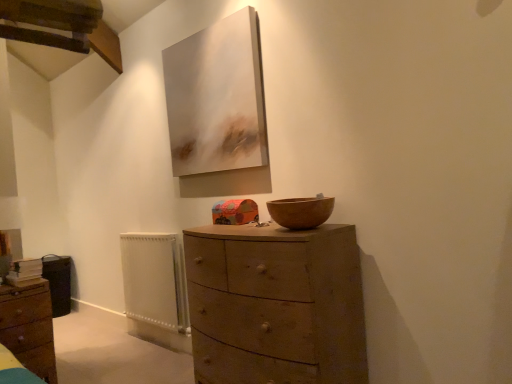
Question: Are wooden bowl at center and white painted metal radiator at lower left making contact?

Choices:
 (A) yes
 (B) no

Answer: (B)

Question: Considering the relative sizes of wooden bowl at center and white painted metal radiator at lower left in the image provided, is wooden bowl at center bigger than white painted metal radiator at lower left?

Choices:
 (A) yes
 (B) no

Answer: (B)

Question: From the image's perspective, is wooden bowl at center located beneath white painted metal radiator at lower left?

Choices:
 (A) yes
 (B) no

Answer: (B)

Question: Is wooden bowl at center outside white painted metal radiator at lower left?

Choices:
 (A) yes
 (B) no

Answer: (A)

Question: Is wooden bowl at center aimed at white painted metal radiator at lower left?

Choices:
 (A) no
 (B) yes

Answer: (A)

Question: Considering the positions of point (41, 377) and point (295, 208), is point (41, 377) closer or farther from the camera than point (295, 208)?

Choices:
 (A) farther
 (B) closer

Answer: (A)

Question: In terms of width, does matte brown chest of drawers at lower left, which ranks as the 2th chest of drawers in right-to-left order, look wider or thinner when compared to wooden bowl at center?

Choices:
 (A) wide
 (B) thin

Answer: (A)

Question: From a real-world perspective, relative to wooden bowl at center, is matte brown chest of drawers at lower left, arranged as the first chest of drawers when viewed from the left, vertically above or below?

Choices:
 (A) below
 (B) above

Answer: (A)

Question: Is matte brown chest of drawers at lower left, which ranks as the 2th chest of drawers in right-to-left order, in front of or behind wooden bowl at center in the image?

Choices:
 (A) front
 (B) behind

Answer: (B)

Question: From the image's perspective, is wooden chest of drawers at center, placed as the 2th chest of drawers when sorted from left to right, above or below matte white canvas at upper center?

Choices:
 (A) above
 (B) below

Answer: (B)

Question: Considering the positions of point (259, 301) and point (181, 100), is point (259, 301) closer or farther from the camera than point (181, 100)?

Choices:
 (A) farther
 (B) closer

Answer: (B)

Question: Considering their positions, is wooden chest of drawers at center, the first chest of drawers in the right-to-left sequence, located in front of or behind matte white canvas at upper center?

Choices:
 (A) behind
 (B) front

Answer: (B)

Question: Considering the positions of wooden chest of drawers at center, placed as the 2th chest of drawers when sorted from left to right, and matte white canvas at upper center in the image, is wooden chest of drawers at center, placed as the 2th chest of drawers when sorted from left to right, wider or thinner than matte white canvas at upper center?

Choices:
 (A) thin
 (B) wide

Answer: (B)

Question: Considering the positions of matte brown chest of drawers at lower left, which ranks as the 2th chest of drawers in right-to-left order, and white painted metal radiator at lower left in the image, is matte brown chest of drawers at lower left, which ranks as the 2th chest of drawers in right-to-left order, wider or thinner than white painted metal radiator at lower left?

Choices:
 (A) wide
 (B) thin

Answer: (A)

Question: From a real-world perspective, is matte brown chest of drawers at lower left, which ranks as the 2th chest of drawers in right-to-left order, positioned above or below white painted metal radiator at lower left?

Choices:
 (A) above
 (B) below

Answer: (B)